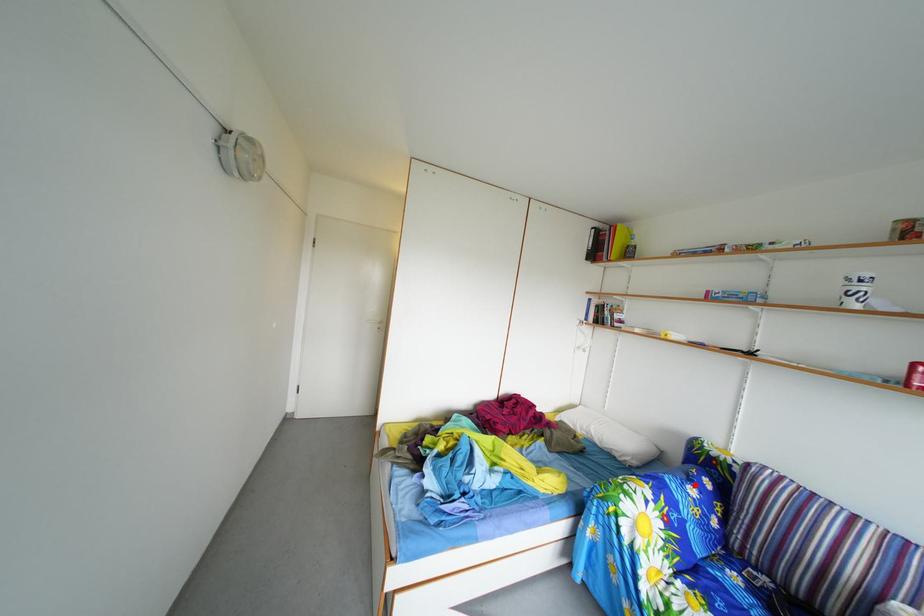
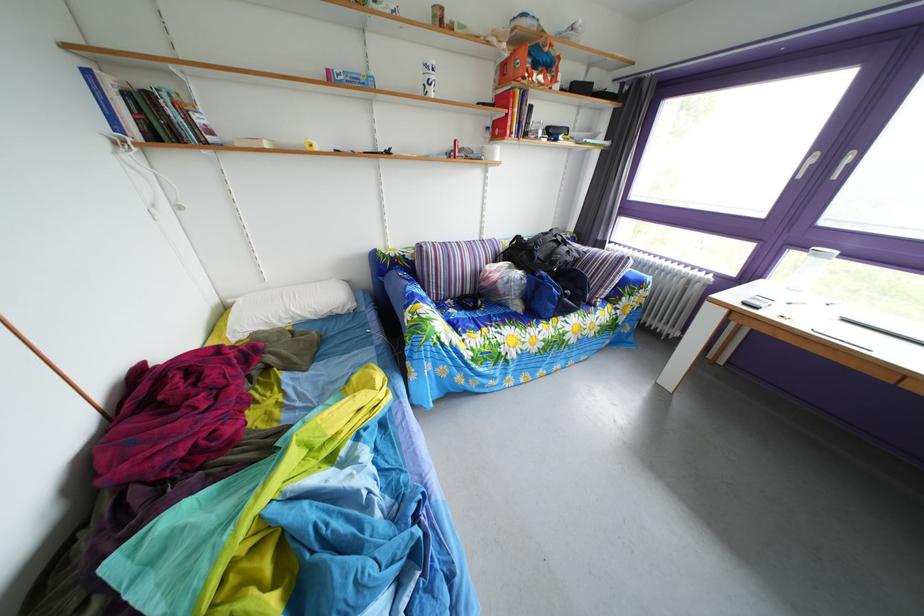
Question: I am providing you with two images of the same scene from different viewpoints. In image1, a red point is highlighted. Considering the same 3D point in image2, which of the following is correct?

Choices:
 (A) It is closer
 (B) It is farther

Answer: (A)